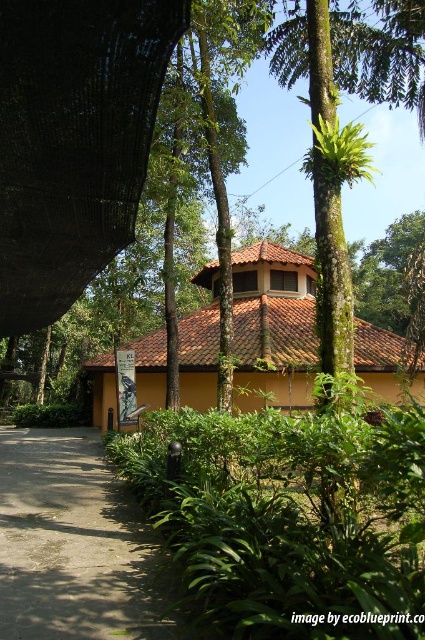
Can you confirm if green leafy shrubs at center is wider than gray concrete driveway at lower left?

Incorrect, green leafy shrubs at center's width does not surpass gray concrete driveway at lower left's.

Which is in front, point (306, 481) or point (68, 596)?

Point (306, 481) is in front.

Identify the location of green leafy shrubs at center. point(291,515).

Between black mesh canopy at upper left and gray concrete driveway at lower left, which one appears on the right side from the viewer's perspective?

From the viewer's perspective, black mesh canopy at upper left appears more on the right side.

Does point (5, 323) come in front of point (68, 515)?

No, it is not.

Between point (110, 120) and point (112, 536), which one is positioned behind?

The point (112, 536) is behind.

This screenshot has height=640, width=425. What are the coordinates of `black mesh canopy at upper left` in the screenshot? It's located at (73, 141).

Does green leafy shrubs at center appear under black mesh canopy at upper left?

Correct, green leafy shrubs at center is located below black mesh canopy at upper left.

At what (x,y) coordinates should I click in order to perform the action: click on green leafy shrubs at center. Please return your answer as a coordinate pair (x, y). This screenshot has width=425, height=640. Looking at the image, I should click on (291, 515).

You are a GUI agent. You are given a task and a screenshot of the screen. Output one action in this format:
    pyautogui.click(x=<x>, y=<y>)
    Task: Click on the green leafy shrubs at center
    Image resolution: width=425 pixels, height=640 pixels.
    Given the screenshot: What is the action you would take?
    pyautogui.click(x=291, y=515)